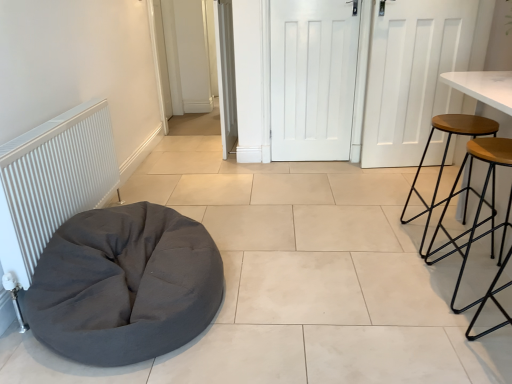
You are a GUI agent. You are given a task and a screenshot of the screen. Output one action in this format:
    pyautogui.click(x=<x>, y=<y>)
    Task: Click on the free space in front of white matte door at center, positioned as the second door in right-to-left order
    Image resolution: width=512 pixels, height=384 pixels.
    Given the screenshot: What is the action you would take?
    pyautogui.click(x=321, y=174)